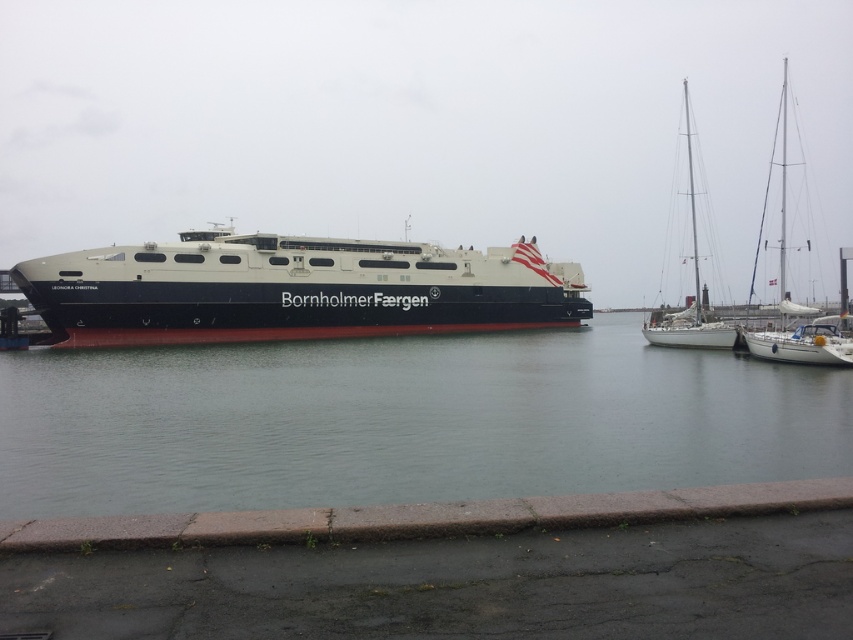
Where is `clear water at center`? The width and height of the screenshot is (853, 640). clear water at center is located at coordinates (404, 420).

Consider the image. Which is above, clear water at center or dark gray matte ferry at center?

dark gray matte ferry at center

Between point (785, 444) and point (469, 256), which one is positioned behind?

Positioned behind is point (469, 256).

The width and height of the screenshot is (853, 640). I want to click on clear water at center, so click(404, 420).

Consider the image. Who is shorter, white glossy sailboat at right or white matte sailboat at right?

With less height is white matte sailboat at right.

Which is in front, point (798, 330) or point (686, 116)?

Positioned in front is point (798, 330).

Image resolution: width=853 pixels, height=640 pixels. Find the location of `white glossy sailboat at right`. white glossy sailboat at right is located at coordinates (792, 301).

Does dark gray matte ferry at center appear on the left side of white glossy sailboat at right?

Indeed, dark gray matte ferry at center is positioned on the left side of white glossy sailboat at right.

I want to click on dark gray matte ferry at center, so click(x=293, y=289).

Which is behind, point (527, 308) or point (793, 358)?

The point (527, 308) is behind.

Identify the location of dark gray matte ferry at center. (293, 289).